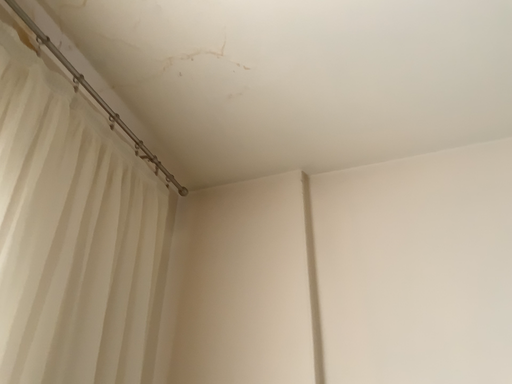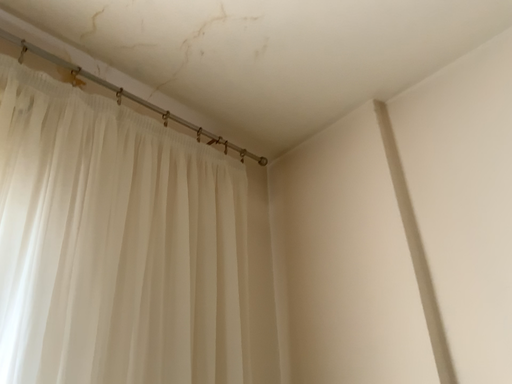
Question: Which way did the camera rotate in the video?

Choices:
 (A) rotated downward
 (B) rotated upward

Answer: (A)